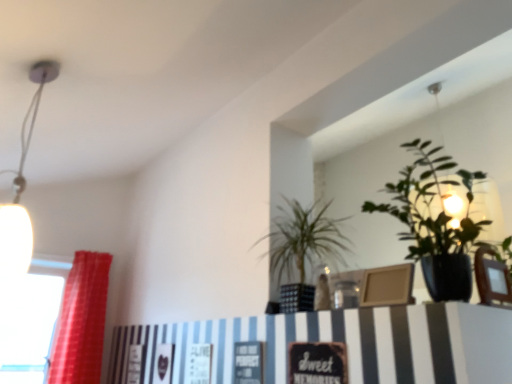
Find the location of a particular element. The image size is (512, 384). empty space that is ontop of white glossy lamp at upper left (from a real-world perspective) is located at coordinates (51, 64).